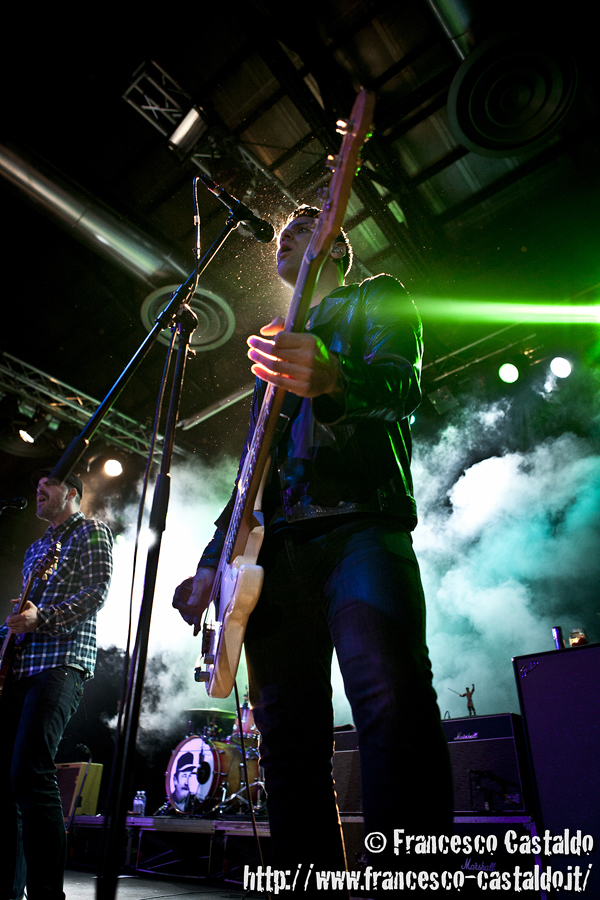
What are the coordinates of `stage` in the screenshot? It's located at point(143,889).